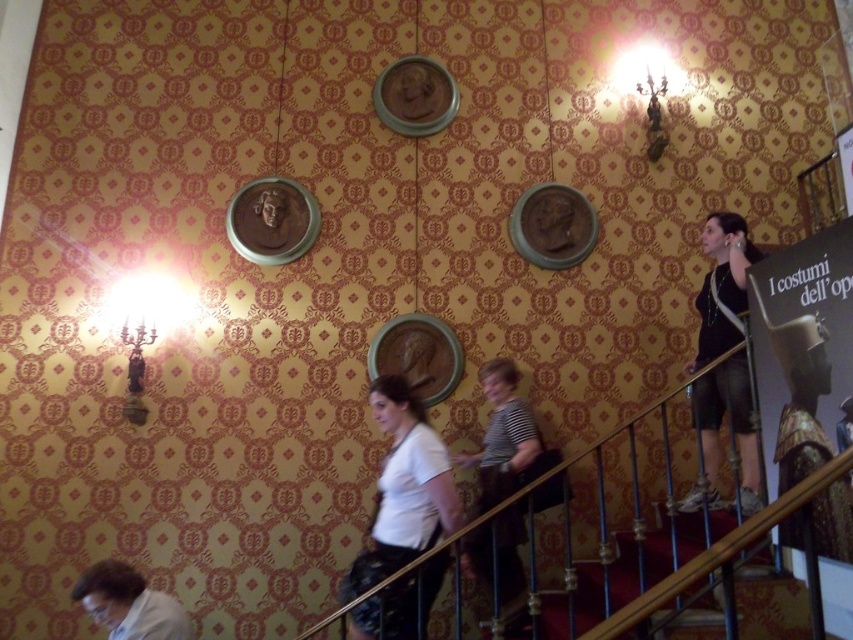
Question: Does dark gray fabric shorts at right have a larger size compared to wooden handrail at lower right?

Choices:
 (A) no
 (B) yes

Answer: (A)

Question: Which point appears closest to the camera in this image?

Choices:
 (A) (165, 627)
 (B) (735, 388)

Answer: (A)

Question: Does white matte shirt at center appear on the left side of white shirt at lower left?

Choices:
 (A) yes
 (B) no

Answer: (B)

Question: Based on their relative distances, which object is farther from the dark gray fabric shorts at right?

Choices:
 (A) wooden handrail at lower right
 (B) white shirt at lower left
 (C) white matte shirt at center

Answer: (B)

Question: Can you confirm if dark gray fabric shorts at right is smaller than white shirt at lower left?

Choices:
 (A) yes
 (B) no

Answer: (B)

Question: Estimate the real-world distances between objects in this image. Which object is farther from the wooden handrail at lower right?

Choices:
 (A) white matte shirt at center
 (B) white shirt at lower left
 (C) dark gray fabric shorts at right

Answer: (B)